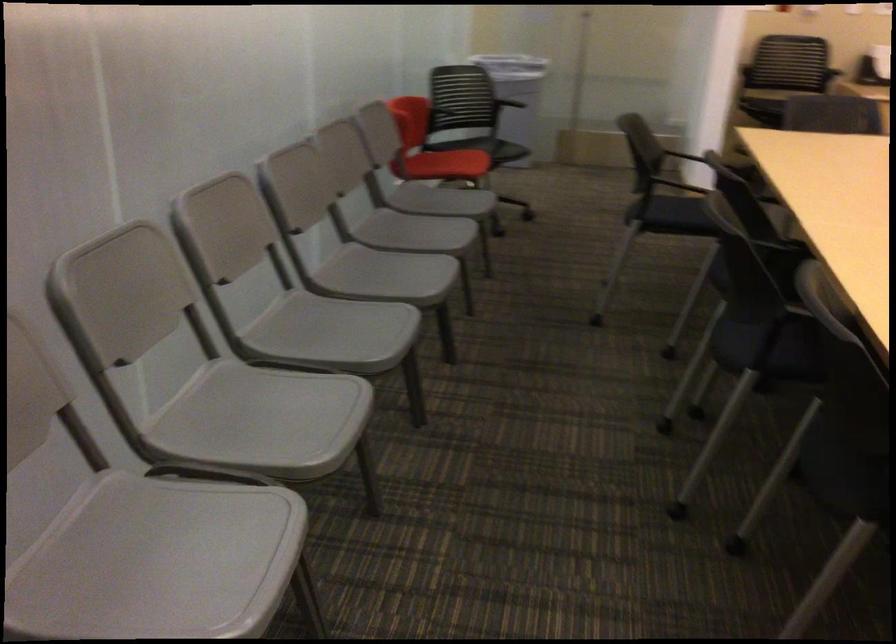
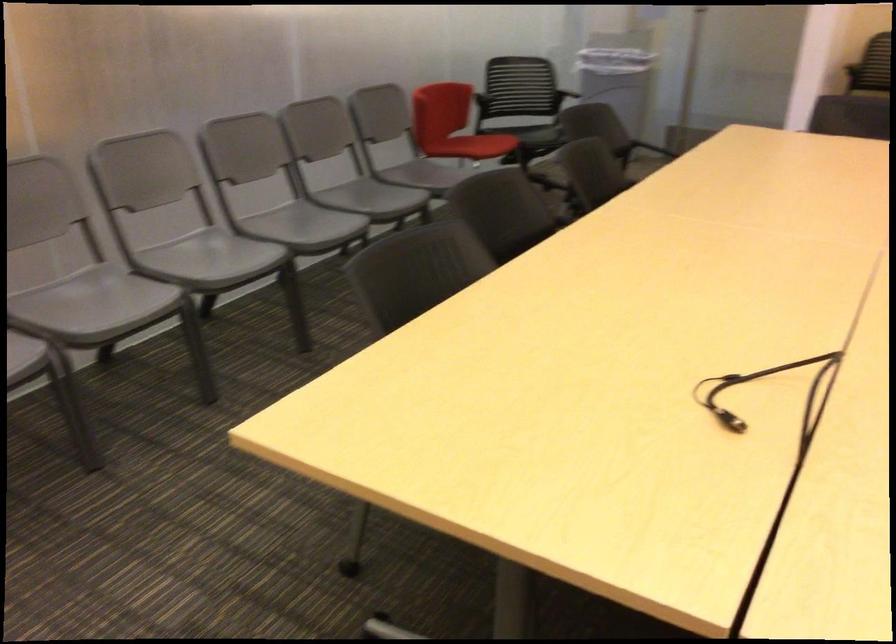
Question: Which direction would the cameraman need to move to produce the second image? Reply with the corresponding letter.

Choices:
 (A) Left
 (B) Right
 (C) Forward
 (D) Backward

Answer: (B)